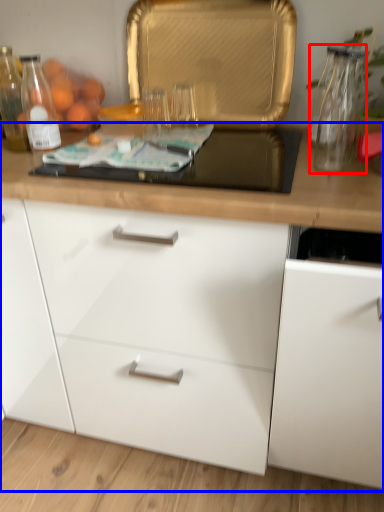
Question: Which of the following is the closest to the observer, glass vase (highlighted by a red box) or cabinetry (highlighted by a blue box)?

Choices:
 (A) glass vase
 (B) cabinetry

Answer: (B)